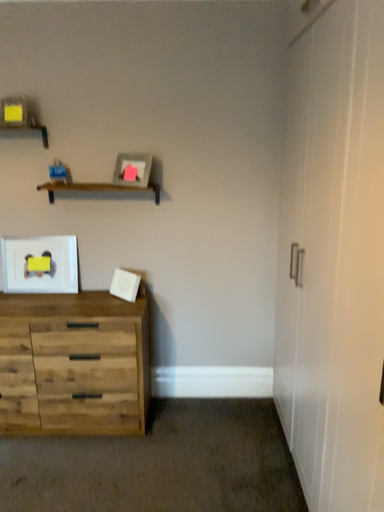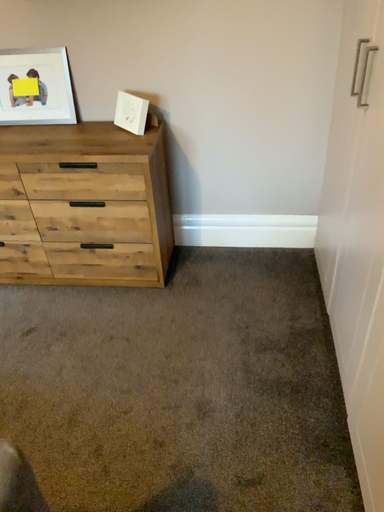
Question: How did the camera likely rotate when shooting the video?

Choices:
 (A) rotated downward
 (B) rotated upward

Answer: (A)